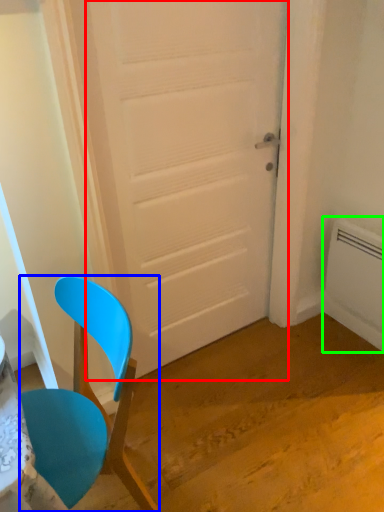
Question: Which object is positioned farthest from door (highlighted by a red box)? Select from chair (highlighted by a blue box) and radiator (highlighted by a green box).

Choices:
 (A) chair
 (B) radiator

Answer: (B)